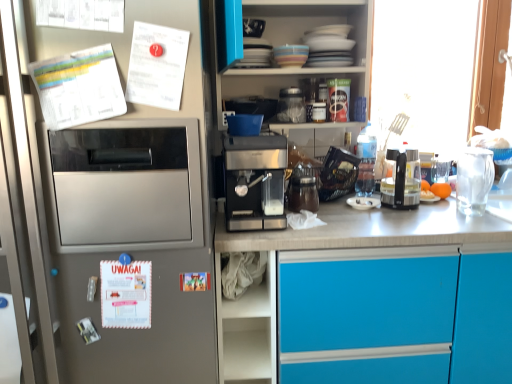
Question: Is transparent glass window at right spatially inside white paper at left, the second postcard from the top, or outside of it?

Choices:
 (A) outside
 (B) inside

Answer: (A)

Question: From the image's perspective, is transparent glass window at right located above or below white paper at left, the second postcard from the top?

Choices:
 (A) above
 (B) below

Answer: (A)

Question: Estimate the real-world distances between objects in this image. Which object is closer to the white fabric at lower center?

Choices:
 (A) blue matte cabinet at center
 (B) white paper at left, which is counted as the 3th postcard, starting from the top
 (C) white paper at upper left, which is the first postcard in top-to-bottom order
 (D) brown matte jar at center, marked as the 1th appliance in a bottom-to-top arrangement
 (E) sleek metallic espresso machine at center

Answer: (E)

Question: Which of these objects is positioned closest to the white paper at left, the second postcard from the bottom?

Choices:
 (A) white paper at left, which is counted as the 3th postcard, starting from the top
 (B) orange matte fruit at right
 (C) white glossy cabinet at upper center
 (D) metallic silver coffee machine at upper center, which ranks as the second appliance in top-to-bottom order
 (E) black plastic coffee machine at center

Answer: (A)